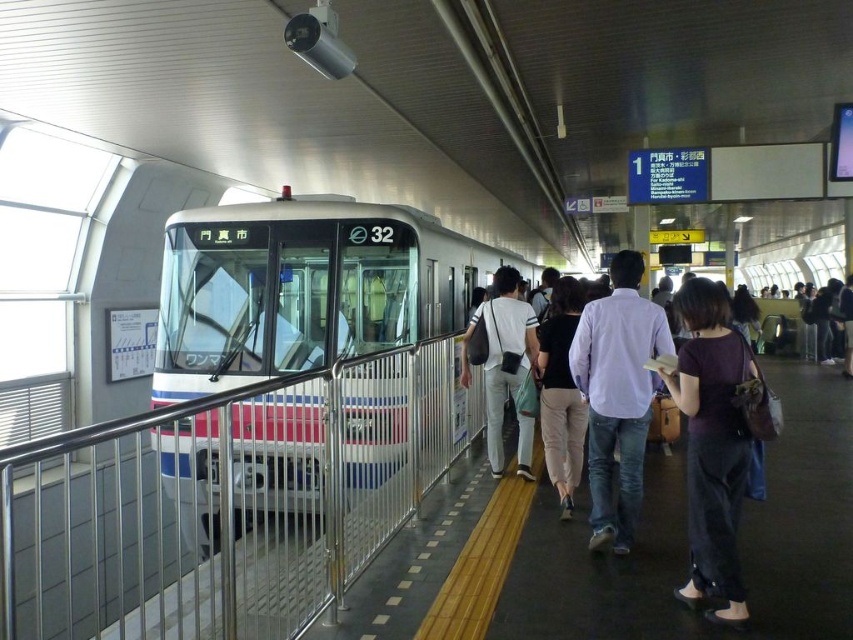
In the scene shown: You are a passenger waiting at the train station. You see a silver metallic rail at left and a white glossy train at center. Which object is closer to the ground?

The silver metallic rail at left is closer to the ground because it is positioned below the white glossy train at center.

You are standing on the train station platform and notice a silver metallic rail at left. Can you determine its exact coordinates based on the platform layout?

The silver metallic rail at left is located at point (225,502) on the platform layout.